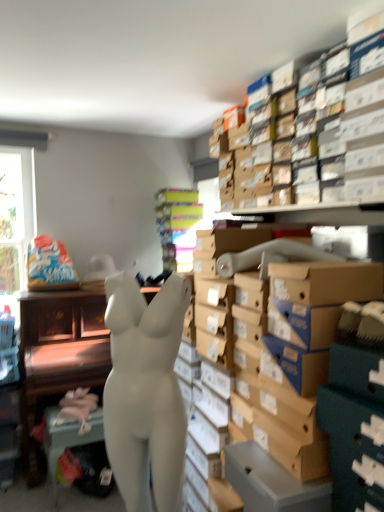
What do you see at coordinates (67, 439) in the screenshot? The height and width of the screenshot is (512, 384). I see `pink fabric at lower left` at bounding box center [67, 439].

Measure the distance between pink fabric at lower left and camera.

A distance of 2.50 meters exists between pink fabric at lower left and camera.

Describe the element at coordinates (145, 391) in the screenshot. The width and height of the screenshot is (384, 512). I see `white matte mannequin at center` at that location.

The width and height of the screenshot is (384, 512). I want to click on white matte mannequin at center, so click(x=145, y=391).

I want to click on white matte mannequin at center, so click(x=58, y=357).

The width and height of the screenshot is (384, 512). Find the location of `pink fabric at lower left`. pink fabric at lower left is located at coordinates (67, 439).

Does pink fabric at lower left have a smaller size compared to white matte mannequin at center?

Yes, pink fabric at lower left is smaller than white matte mannequin at center.

This screenshot has height=512, width=384. What are the coordinates of `table lying behind the white matte mannequin at center` in the screenshot? It's located at (67, 439).

Considering the relative positions of multicolored cardboard boxes at center and pink fabric at lower left in the image provided, is multicolored cardboard boxes at center to the right of pink fabric at lower left from the viewer's perspective?

Yes.

From the image's perspective, which object appears higher, multicolored cardboard boxes at center or pink fabric at lower left?

From the image's view, multicolored cardboard boxes at center is above.

Is multicolored cardboard boxes at center in front of or behind pink fabric at lower left in the image?

multicolored cardboard boxes at center is positioned farther from the viewer than pink fabric at lower left.

Considering the sizes of multicolored cardboard boxes at center and pink fabric at lower left in the image, is multicolored cardboard boxes at center taller or shorter than pink fabric at lower left?

multicolored cardboard boxes at center is taller than pink fabric at lower left.

Considering the sizes of objects white matte mannequin at center and white matte mannequin at center in the image provided, who is shorter, white matte mannequin at center or white matte mannequin at center?

With less height is white matte mannequin at center.

The height and width of the screenshot is (512, 384). In order to click on furniture located behind the white matte mannequin at center in this screenshot , I will do `click(58, 357)`.

Is white matte mannequin at center positioned far away from white matte mannequin at center?

white matte mannequin at center is positioned a significant distance from white matte mannequin at center.

Which is more distant, [118,318] or [63,379]?

The point [63,379] is farther.

Considering the positions of point (54, 473) and point (162, 232), is point (54, 473) closer or farther from the camera than point (162, 232)?

Point (54, 473) is closer to the camera than point (162, 232).

Considering their positions, is pink fabric at lower left located in front of or behind multicolored cardboard boxes at center?

Clearly, pink fabric at lower left is in front of multicolored cardboard boxes at center.

Looking at this image, who is smaller, pink fabric at lower left or multicolored cardboard boxes at center?

With smaller size is pink fabric at lower left.

Considering the sizes of pink fabric at lower left and multicolored cardboard boxes at center in the image, is pink fabric at lower left wider or thinner than multicolored cardboard boxes at center?

In the image, pink fabric at lower left appears to be more narrow than multicolored cardboard boxes at center.

Is white matte mannequin at center located outside multicolored cardboard boxes at center?

Yes, white matte mannequin at center is outside of multicolored cardboard boxes at center.

Which of these two, white matte mannequin at center or multicolored cardboard boxes at center, is wider?

white matte mannequin at center is wider.

Is white matte mannequin at center far from multicolored cardboard boxes at center?

They are positioned close to each other.

Who is shorter, white matte mannequin at center or multicolored cardboard boxes at center?

With less height is multicolored cardboard boxes at center.

Considering the relative positions of multicolored cardboard boxes at center and white matte mannequin at center in the image provided, is multicolored cardboard boxes at center to the right of white matte mannequin at center from the viewer's perspective?

Correct, you'll find multicolored cardboard boxes at center to the right of white matte mannequin at center.

Locate an element on the screen. This screenshot has width=384, height=512. person located in front of the multicolored cardboard boxes at center is located at coordinates (145, 391).

From the image's perspective, is multicolored cardboard boxes at center located beneath white matte mannequin at center?

No, from the image's perspective, multicolored cardboard boxes at center is not below white matte mannequin at center.

Considering the sizes of objects multicolored cardboard boxes at center and white matte mannequin at center in the image provided, who is bigger, multicolored cardboard boxes at center or white matte mannequin at center?

With larger size is white matte mannequin at center.

Considering the relative sizes of multicolored cardboard boxes at center and white matte mannequin at center in the image provided, is multicolored cardboard boxes at center smaller than white matte mannequin at center?

Yes.

Considering the points (168, 254) and (41, 469), which point is in front, point (168, 254) or point (41, 469)?

Positioned in front is point (41, 469).

In the scene shown: Is multicolored cardboard boxes at center placed right next to white matte mannequin at center?

They are not placed beside each other.

Considering the relative sizes of multicolored cardboard boxes at center and white matte mannequin at center in the image provided, is multicolored cardboard boxes at center wider than white matte mannequin at center?

No.

The height and width of the screenshot is (512, 384). I want to click on person on the right of pink fabric at lower left, so click(x=145, y=391).

Locate an element on the screen. Image resolution: width=384 pixels, height=512 pixels. shelf behind the pink fabric at lower left is located at coordinates (175, 219).

When comparing their distances from multicolored cardboard boxes at center, does pink fabric at lower left or white matte mannequin at center seem closer?

pink fabric at lower left lies closer to multicolored cardboard boxes at center than the other object.

Considering their positions, is multicolored cardboard boxes at center positioned further to pink fabric at lower left than white matte mannequin at center?

multicolored cardboard boxes at center.

Looking at the image, which one is located further to white matte mannequin at center, multicolored cardboard boxes at center or pink fabric at lower left?

multicolored cardboard boxes at center is further to white matte mannequin at center.

From the image, which object appears to be nearer to white matte mannequin at center, white matte mannequin at center or pink fabric at lower left?

Among the two, pink fabric at lower left is located nearer to white matte mannequin at center.

Estimate the real-world distances between objects in this image. Which object is closer to multicolored cardboard boxes at center, white matte mannequin at center or white matte mannequin at center?

white matte mannequin at center is positioned closer to the anchor multicolored cardboard boxes at center.

Estimate the real-world distances between objects in this image. Which object is further from white matte mannequin at center, pink fabric at lower left or multicolored cardboard boxes at center?

multicolored cardboard boxes at center.

Based on their spatial positions, is white matte mannequin at center or pink fabric at lower left closer to multicolored cardboard boxes at center?

The object closer to multicolored cardboard boxes at center is pink fabric at lower left.

Estimate the real-world distances between objects in this image. Which object is further from white matte mannequin at center, multicolored cardboard boxes at center or white matte mannequin at center?

white matte mannequin at center.

Locate an element on the screen. table between white matte mannequin at center and multicolored cardboard boxes at center from front to back is located at coordinates (67, 439).

You are a GUI agent. You are given a task and a screenshot of the screen. Output one action in this format:
    pyautogui.click(x=<x>, y=<y>)
    Task: Click on the furniture that lies between multicolored cardboard boxes at center and pink fabric at lower left from top to bottom
    Image resolution: width=384 pixels, height=512 pixels.
    Given the screenshot: What is the action you would take?
    pyautogui.click(x=58, y=357)

Locate an element on the screen. This screenshot has height=512, width=384. table between white matte mannequin at center and white matte mannequin at center from front to back is located at coordinates (67, 439).

Image resolution: width=384 pixels, height=512 pixels. Find the location of `furniture positioned between white matte mannequin at center and multicolored cardboard boxes at center from near to far`. furniture positioned between white matte mannequin at center and multicolored cardboard boxes at center from near to far is located at coordinates (58, 357).